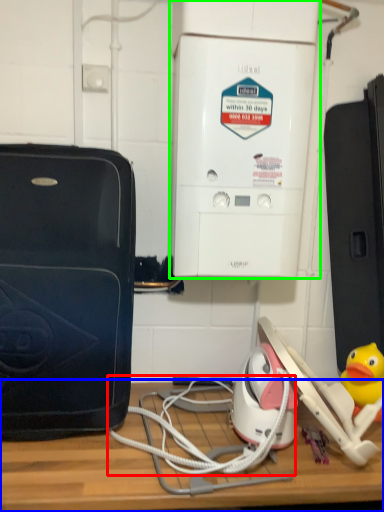
Question: Based on their relative distances, which object is nearer to cable (highlighted by a red box)? Choose from table (highlighted by a blue box) and home appliance (highlighted by a green box).

Choices:
 (A) table
 (B) home appliance

Answer: (A)